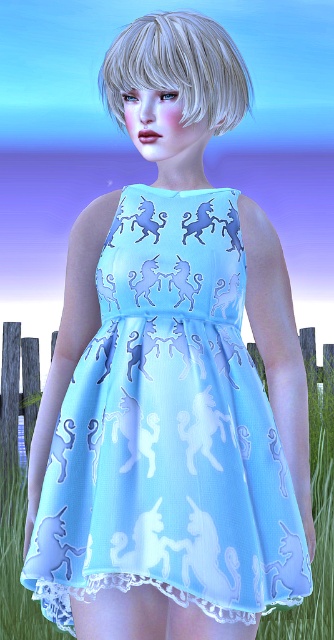
Question: Which point is closer to the camera?

Choices:
 (A) [137, 42]
 (B) [176, 330]

Answer: (B)

Question: Does light blue fabric dress at center come in front of wooden fence at lower center?

Choices:
 (A) yes
 (B) no

Answer: (A)

Question: Which of the following is the closest to the observer?

Choices:
 (A) light blue fabric dress at center
 (B) blonde silky hair at upper center
 (C) wooden fence at lower center

Answer: (A)

Question: Is light blue fabric dress at center behind blonde silky hair at upper center?

Choices:
 (A) no
 (B) yes

Answer: (A)

Question: Does light blue fabric dress at center appear on the right side of blonde silky hair at upper center?

Choices:
 (A) yes
 (B) no

Answer: (B)

Question: Which of the following is the closest to the observer?

Choices:
 (A) wooden fence at lower center
 (B) blonde silky hair at upper center

Answer: (B)